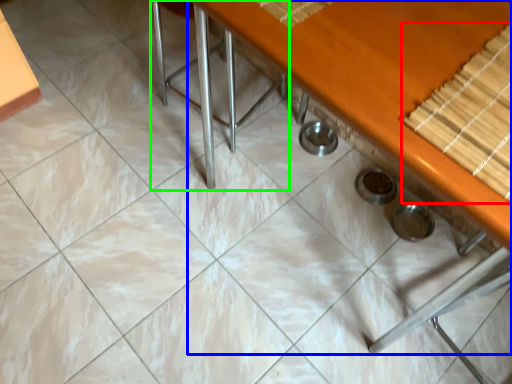
Question: Which is farther away from wood (highlighted by a red box)? table (highlighted by a blue box) or chair (highlighted by a green box)?

Choices:
 (A) table
 (B) chair

Answer: (B)